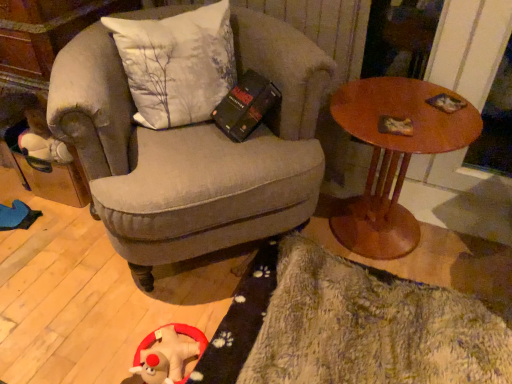
Question: Does fuzzy plush toy at lower left come behind wooden round table at right?

Choices:
 (A) yes
 (B) no

Answer: (B)

Question: Considering the relative positions of fuzzy plush toy at lower left and wooden round table at right in the image provided, is fuzzy plush toy at lower left to the left of wooden round table at right from the viewer's perspective?

Choices:
 (A) no
 (B) yes

Answer: (B)

Question: From the image's perspective, is fuzzy plush toy at lower left located above wooden round table at right?

Choices:
 (A) no
 (B) yes

Answer: (A)

Question: Can you confirm if fuzzy plush toy at lower left is wider than wooden round table at right?

Choices:
 (A) no
 (B) yes

Answer: (A)

Question: Can you confirm if fuzzy plush toy at lower left is shorter than wooden round table at right?

Choices:
 (A) yes
 (B) no

Answer: (A)

Question: In terms of width, does fluffy beige rug at lower right look wider or thinner when compared to textured gray armchair at center?

Choices:
 (A) thin
 (B) wide

Answer: (A)

Question: Is fluffy beige rug at lower right bigger or smaller than textured gray armchair at center?

Choices:
 (A) small
 (B) big

Answer: (A)

Question: In the image, is fluffy beige rug at lower right positioned in front of or behind textured gray armchair at center?

Choices:
 (A) behind
 (B) front

Answer: (B)

Question: From a real-world perspective, is fluffy beige rug at lower right physically located above or below textured gray armchair at center?

Choices:
 (A) below
 (B) above

Answer: (A)

Question: Which is correct: wooden round table at right is inside textured gray armchair at center, or outside of it?

Choices:
 (A) inside
 (B) outside

Answer: (B)

Question: From the image's perspective, is wooden round table at right above or below textured gray armchair at center?

Choices:
 (A) below
 (B) above

Answer: (A)

Question: Considering their positions, is wooden round table at right located in front of or behind textured gray armchair at center?

Choices:
 (A) behind
 (B) front

Answer: (A)

Question: Is wooden round table at right wider or thinner than textured gray armchair at center?

Choices:
 (A) thin
 (B) wide

Answer: (A)

Question: From the image's perspective, is textured gray armchair at center located above or below wooden round table at right?

Choices:
 (A) below
 (B) above

Answer: (B)

Question: Looking at the image, does textured gray armchair at center seem bigger or smaller compared to wooden round table at right?

Choices:
 (A) big
 (B) small

Answer: (A)